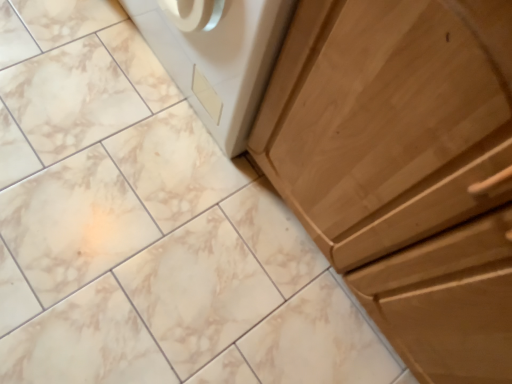
Question: Which direction should I rotate to look at white glossy washing machine at upper center?

Choices:
 (A) right
 (B) left

Answer: (A)

Question: Is wooden cabinet at right wider than white glossy washing machine at upper center?

Choices:
 (A) yes
 (B) no

Answer: (A)

Question: Considering the relative sizes of wooden cabinet at right and white glossy washing machine at upper center in the image provided, is wooden cabinet at right bigger than white glossy washing machine at upper center?

Choices:
 (A) yes
 (B) no

Answer: (A)

Question: Could you tell me if wooden cabinet at right is turned towards white glossy washing machine at upper center?

Choices:
 (A) no
 (B) yes

Answer: (A)

Question: Is wooden cabinet at right at the right side of white glossy washing machine at upper center?

Choices:
 (A) yes
 (B) no

Answer: (A)

Question: Considering the relative sizes of wooden cabinet at right and white glossy washing machine at upper center in the image provided, is wooden cabinet at right taller than white glossy washing machine at upper center?

Choices:
 (A) no
 (B) yes

Answer: (B)

Question: Does wooden cabinet at right have a lesser width compared to white glossy washing machine at upper center?

Choices:
 (A) yes
 (B) no

Answer: (B)

Question: Would you say wooden cabinet at right is part of white glossy washing machine at upper center's contents?

Choices:
 (A) yes
 (B) no

Answer: (B)

Question: Does white glossy washing machine at upper center appear on the right side of wooden cabinet at right?

Choices:
 (A) yes
 (B) no

Answer: (B)

Question: Is white glossy washing machine at upper center oriented towards wooden cabinet at right?

Choices:
 (A) yes
 (B) no

Answer: (B)

Question: From a real-world perspective, does white glossy washing machine at upper center sit lower than wooden cabinet at right?

Choices:
 (A) no
 (B) yes

Answer: (B)

Question: Is white glossy washing machine at upper center not inside wooden cabinet at right?

Choices:
 (A) yes
 (B) no

Answer: (A)

Question: Is white glossy washing machine at upper center smaller than wooden cabinet at right?

Choices:
 (A) no
 (B) yes

Answer: (B)

Question: Is wooden cabinet at right taller or shorter than white glossy washing machine at upper center?

Choices:
 (A) tall
 (B) short

Answer: (A)